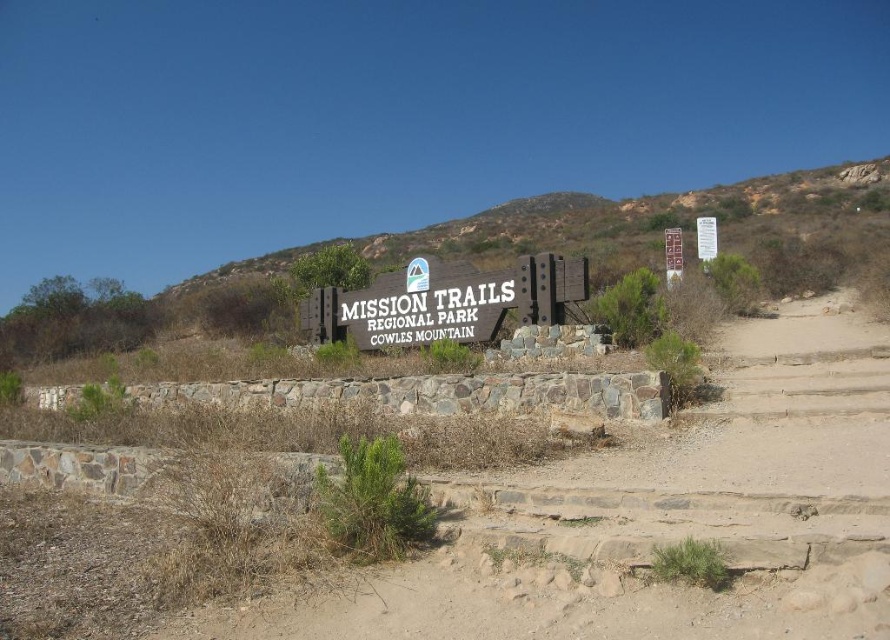
Does wooden sign at upper right have a greater height compared to white paper sign at upper center?

No.

Between wooden sign at upper right and white paper sign at upper center, which one appears on the left side from the viewer's perspective?

wooden sign at upper right

Describe the element at coordinates (672, 253) in the screenshot. I see `wooden sign at upper right` at that location.

In order to click on wooden sign at upper right in this screenshot , I will do `click(672, 253)`.

Which is above, brown stone steps at center or wooden sign at center?

wooden sign at center is higher up.

Does point (689, 515) come closer to viewer compared to point (527, 256)?

Yes, it is in front of point (527, 256).

Is point (886, 472) positioned after point (496, 280)?

That is False.

The height and width of the screenshot is (640, 890). I want to click on brown stone steps at center, so click(717, 458).

Is brown stone steps at center smaller than white paper sign at upper center?

Correct, brown stone steps at center occupies less space than white paper sign at upper center.

Between brown stone steps at center and white paper sign at upper center, which one appears on the right side from the viewer's perspective?

white paper sign at upper center is more to the right.

Identify the location of brown stone steps at center. This screenshot has height=640, width=890. (717, 458).